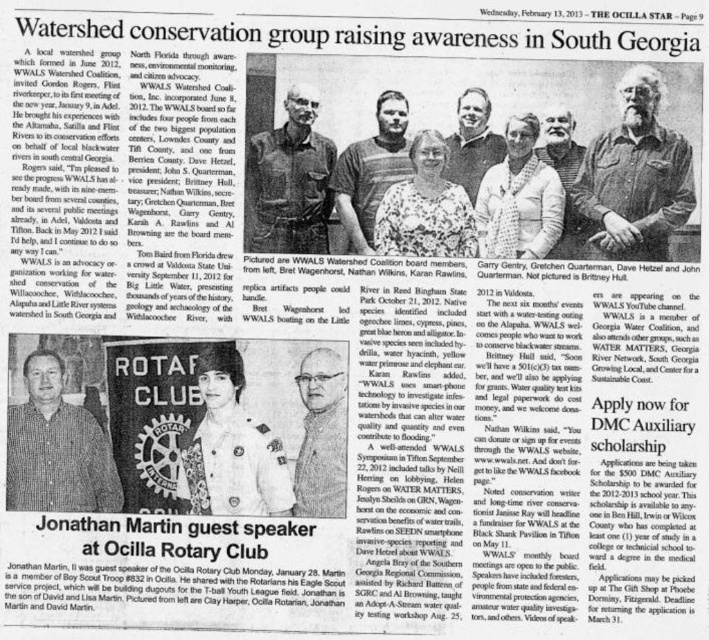
Question: Is light brown hair at center to the left of striped sweater at center from the viewer's perspective?

Choices:
 (A) yes
 (B) no

Answer: (B)

Question: Is grayish-brown leather jacket at upper right thinner than light brown hair at center?

Choices:
 (A) yes
 (B) no

Answer: (B)

Question: Among these objects, which one is farthest from the camera?

Choices:
 (A) white knitted sweater at center
 (B) striped sweater at center
 (C) white uniform shirt at center
 (D) light brown hair at center

Answer: (A)

Question: Which object is the closest to the gray hair at center?

Choices:
 (A) white uniform shirt at center
 (B) striped sweater at center

Answer: (B)

Question: Can you confirm if white uniform shirt at center is positioned to the right of gray hair at center?

Choices:
 (A) no
 (B) yes

Answer: (A)

Question: Estimate the real-world distances between objects in this image. Which object is closer to the grayish-brown leather jacket at upper right?

Choices:
 (A) light brown hair at center
 (B) plaid shirt at lower left
 (C) dark blue uniform at center

Answer: (A)